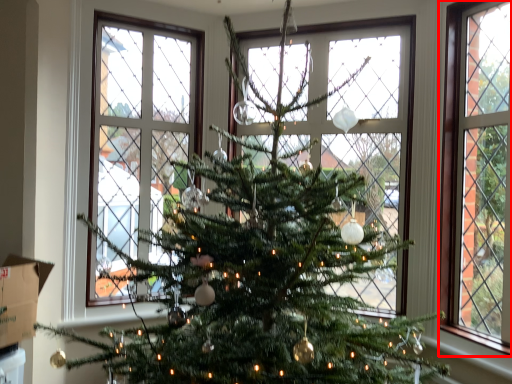
Question: Considering the relative positions of window (annotated by the red box) and cardboard box in the image provided, where is window (annotated by the red box) located with respect to the staircase?

Choices:
 (A) right
 (B) left

Answer: (A)